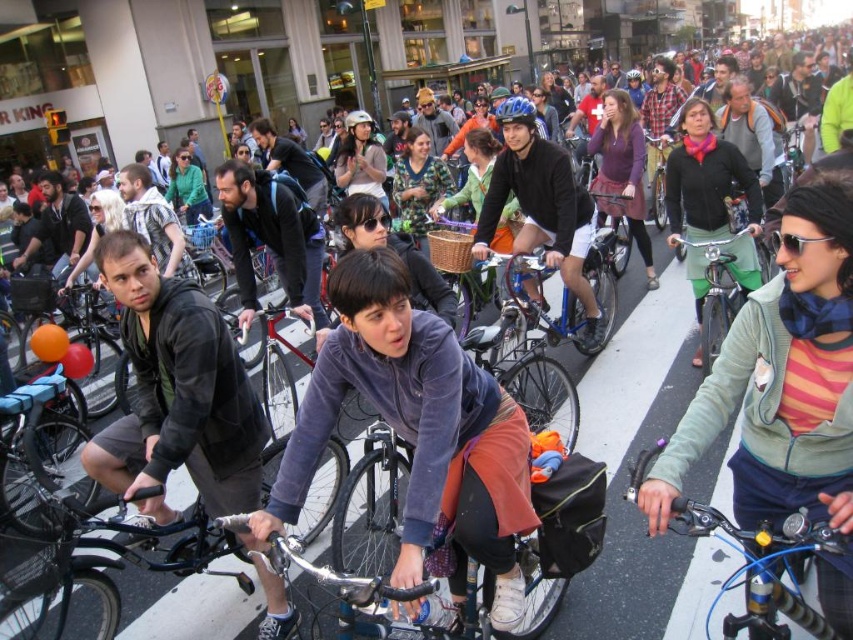
You are a photographer standing on the sidewalk observing the cyclists. You want to take a photo that includes both the green fabric skirt at center and the matte purple sweater at center. Which object will appear larger in your photo?

The green fabric skirt at center will appear larger in the photo because it is closer to the viewer than the matte purple sweater at center.

You are a pedestrian standing on the sidewalk observing the metallic blue bicycle at center and the matte blue helmet at center. Which object is nearer to you?

The metallic blue bicycle at center is closer to the viewer than the matte blue helmet at center.